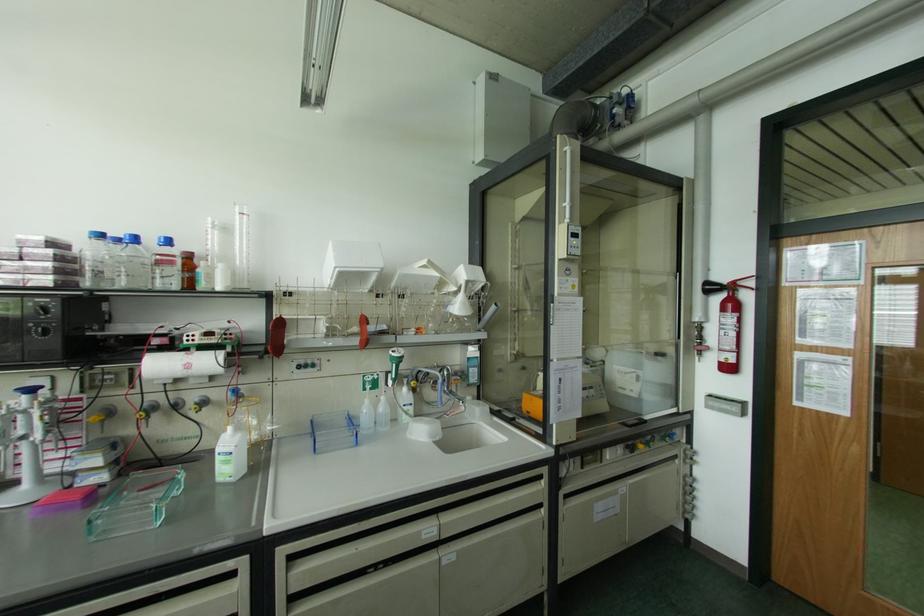
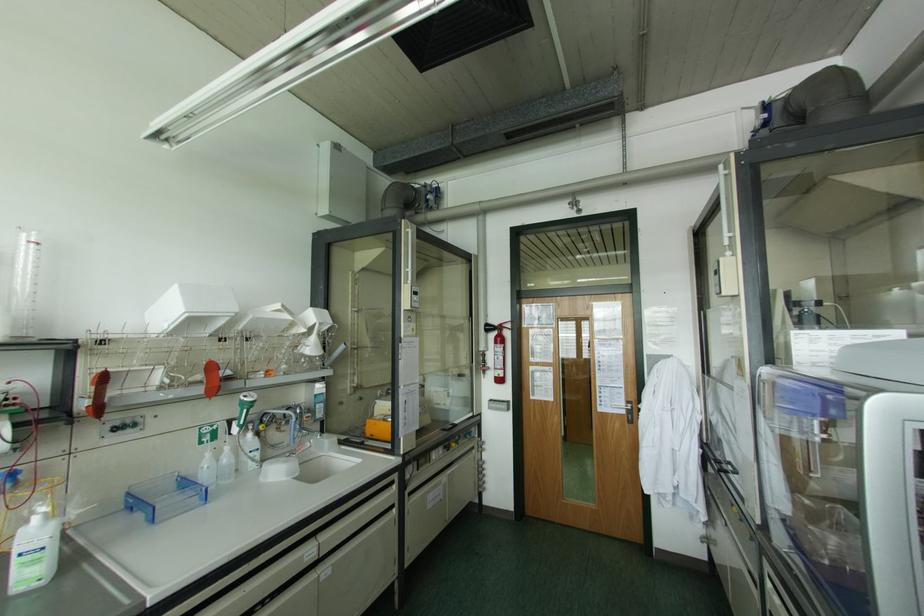
Locate, in the second image, the point that corresponds to pixel 311 421 in the first image.

(128, 493)